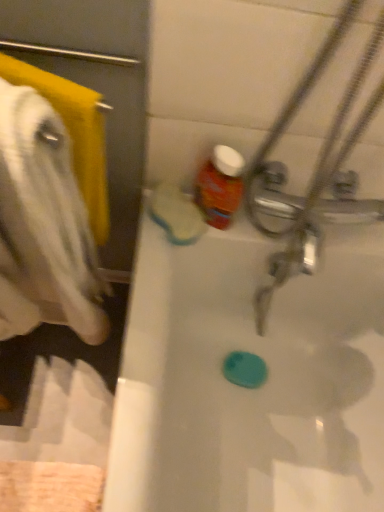
The width and height of the screenshot is (384, 512). Find the location of `free space to the left of matte plastic bottle at upper center`. free space to the left of matte plastic bottle at upper center is located at coordinates (169, 210).